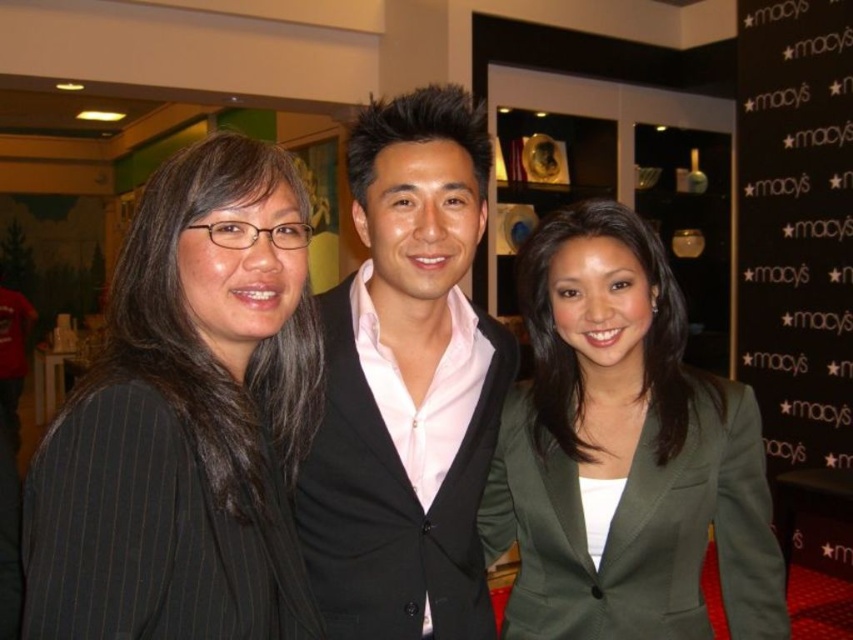
Can you confirm if black pinstripe blazer at left is smaller than green matte blazer at center?

Indeed, black pinstripe blazer at left has a smaller size compared to green matte blazer at center.

Does point (213, 452) come behind point (769, 509)?

No.

The image size is (853, 640). I want to click on black pinstripe blazer at left, so (x=186, y=420).

This screenshot has height=640, width=853. In order to click on black pinstripe blazer at left in this screenshot , I will do `click(186, 420)`.

Can you confirm if black pinstripe blazer at left is smaller than black fabric at right?

Yes, black pinstripe blazer at left is smaller than black fabric at right.

Which is below, black pinstripe blazer at left or black fabric at right?

Positioned lower is black pinstripe blazer at left.

Between point (192, 493) and point (793, 259), which one is positioned in front?

Point (192, 493) is in front.

Where is `black pinstripe blazer at left`? black pinstripe blazer at left is located at coordinates (186, 420).

At what (x,y) coordinates should I click in order to perform the action: click on matte black suit at center. Please return your answer as a coordinate pair (x, y). The height and width of the screenshot is (640, 853). Looking at the image, I should click on (405, 385).

Where is `matte black suit at center`? The width and height of the screenshot is (853, 640). matte black suit at center is located at coordinates (405, 385).